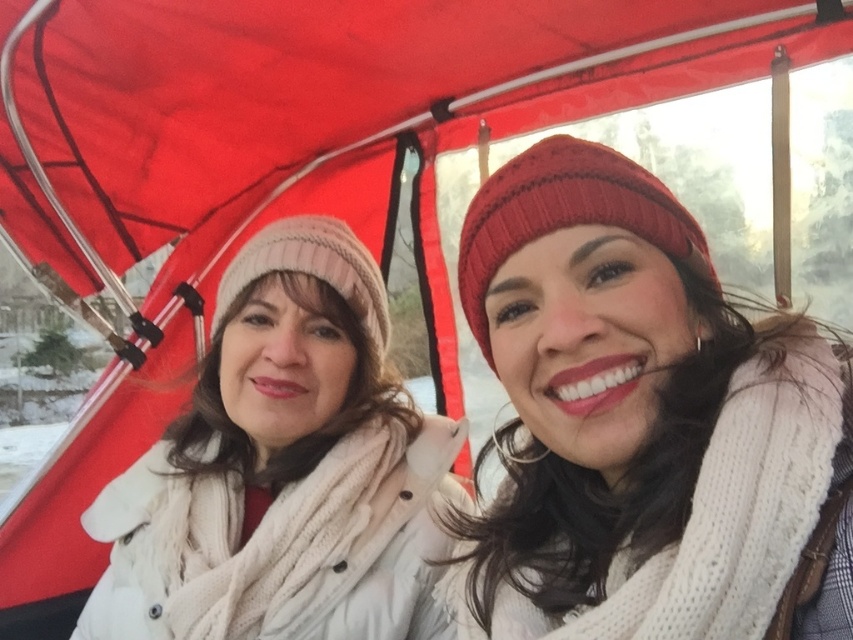
In the scene shown: You are a photographer trying to capture the knitted red beanie at upper right in the image. The camera you are using has a focus point at coordinate point (642, 422). Will this focus point align with the knitted red beanie at upper right?

The knitted red beanie at upper right is located at point (642, 422), so yes, the focus point at coordinate point (642, 422) will align with the knitted red beanie at upper right.

You are a fashion designer observing two people in a vehicle. You need to determine which hat is more suitable for a child based on size. Which hat between the knitted red beanie at upper right and the white knit hat at left is smaller?

The knitted red beanie at upper right is smaller than the white knit hat at left, making it more suitable for a child.